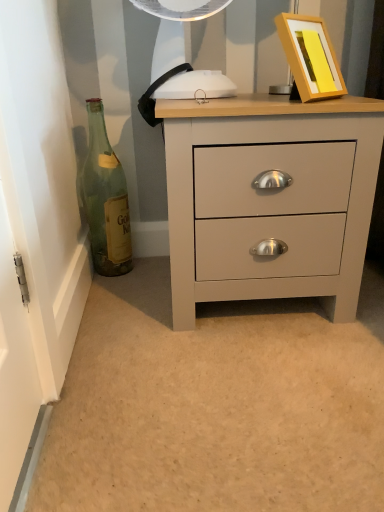
Question: Is matte gray chest of drawers at center wider than green glass bottle at left?

Choices:
 (A) yes
 (B) no

Answer: (A)

Question: Is matte gray chest of drawers at center oriented towards green glass bottle at left?

Choices:
 (A) no
 (B) yes

Answer: (A)

Question: From a real-world perspective, is matte gray chest of drawers at center physically above green glass bottle at left?

Choices:
 (A) no
 (B) yes

Answer: (A)

Question: Is matte gray chest of drawers at center to the right of green glass bottle at left from the viewer's perspective?

Choices:
 (A) yes
 (B) no

Answer: (A)

Question: Does matte gray chest of drawers at center have a smaller size compared to green glass bottle at left?

Choices:
 (A) yes
 (B) no

Answer: (B)

Question: Does matte gray chest of drawers at center contain green glass bottle at left?

Choices:
 (A) no
 (B) yes

Answer: (A)

Question: Is yellow matte picture frame at upper right to the right of green glass bottle at left from the viewer's perspective?

Choices:
 (A) yes
 (B) no

Answer: (A)

Question: Could you tell me if yellow matte picture frame at upper right is turned towards green glass bottle at left?

Choices:
 (A) yes
 (B) no

Answer: (B)

Question: Considering the relative sizes of yellow matte picture frame at upper right and green glass bottle at left in the image provided, is yellow matte picture frame at upper right taller than green glass bottle at left?

Choices:
 (A) yes
 (B) no

Answer: (B)

Question: From the image's perspective, is yellow matte picture frame at upper right under green glass bottle at left?

Choices:
 (A) no
 (B) yes

Answer: (A)

Question: Are yellow matte picture frame at upper right and green glass bottle at left beside each other?

Choices:
 (A) yes
 (B) no

Answer: (B)

Question: Is yellow matte picture frame at upper right bigger than green glass bottle at left?

Choices:
 (A) no
 (B) yes

Answer: (B)

Question: Is green glass bottle at left positioned before matte gray chest of drawers at center?

Choices:
 (A) yes
 (B) no

Answer: (B)